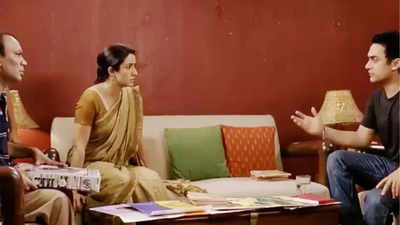
Where is `throw pillows`? The width and height of the screenshot is (400, 225). throw pillows is located at coordinates (219, 153), (263, 150).